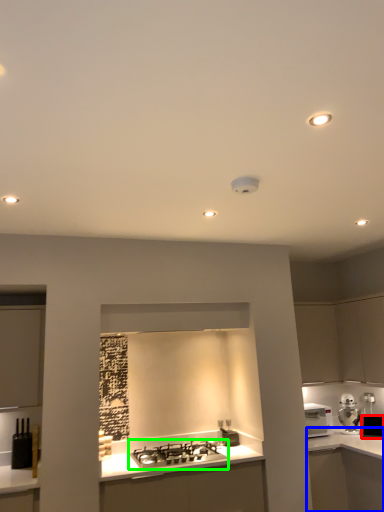
Question: Which object is the closest to the appliance (highlighted by a red box)? Choose among these: counter (highlighted by a blue box) or gas stove (highlighted by a green box).

Choices:
 (A) counter
 (B) gas stove

Answer: (A)